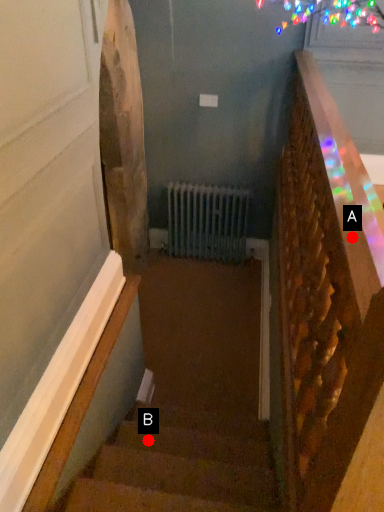
Question: Two points are circled on the image, labeled by A and B beside each circle. Which of the following is the farthest from the observer?

Choices:
 (A) A is further
 (B) B is further

Answer: (B)